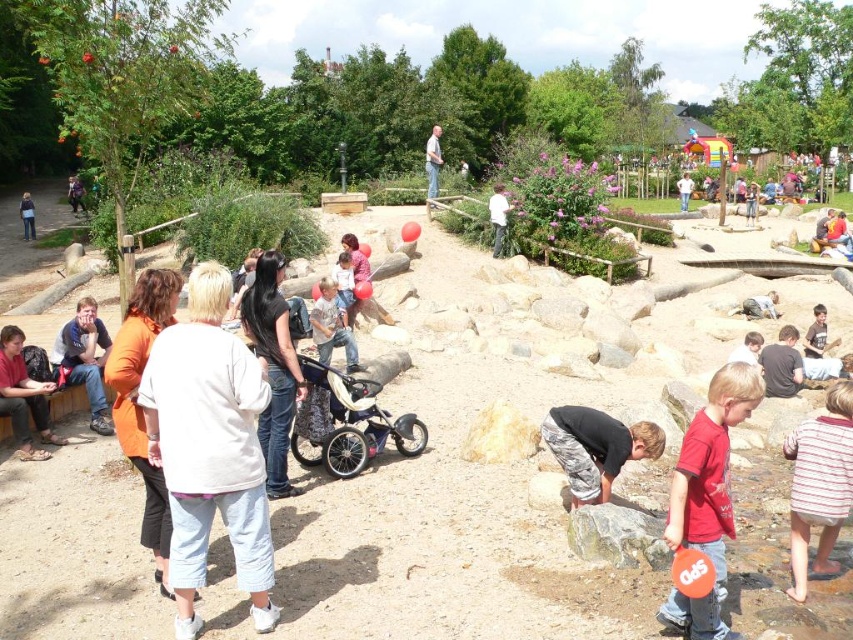
You are a parent at the zoo with your child. You notice a white cotton sweater at center and a matte red shirt at left. Which clothing item is taller?

The white cotton sweater at center is much taller than the matte red shirt at left.

You are a parent at the zoo with a stroller. You see the orange fabric jacket at lower left and the light blue denim jeans at center. Which object is closer to the ground?

The orange fabric jacket at lower left is located below light blue denim jeans at center, so the orange fabric jacket at lower left is closer to the ground.